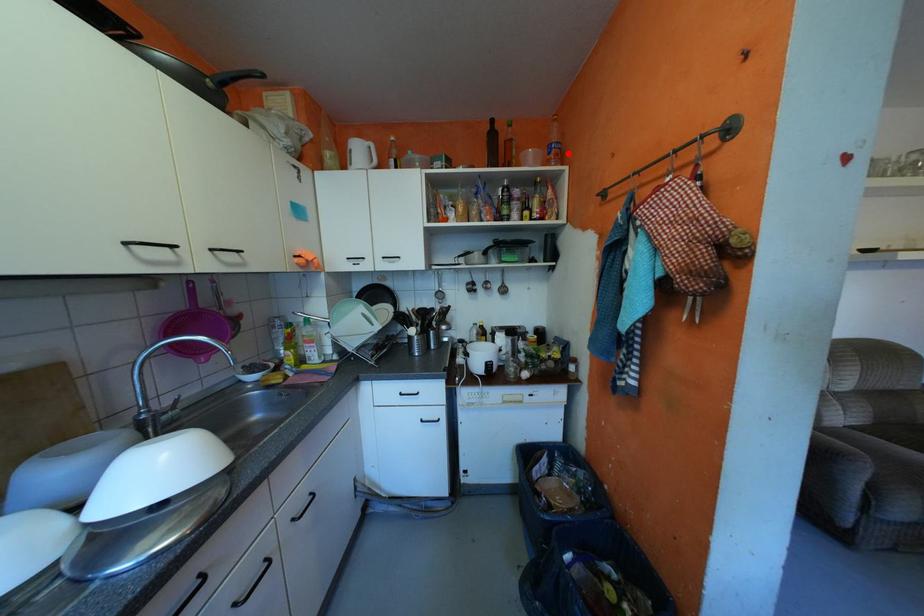
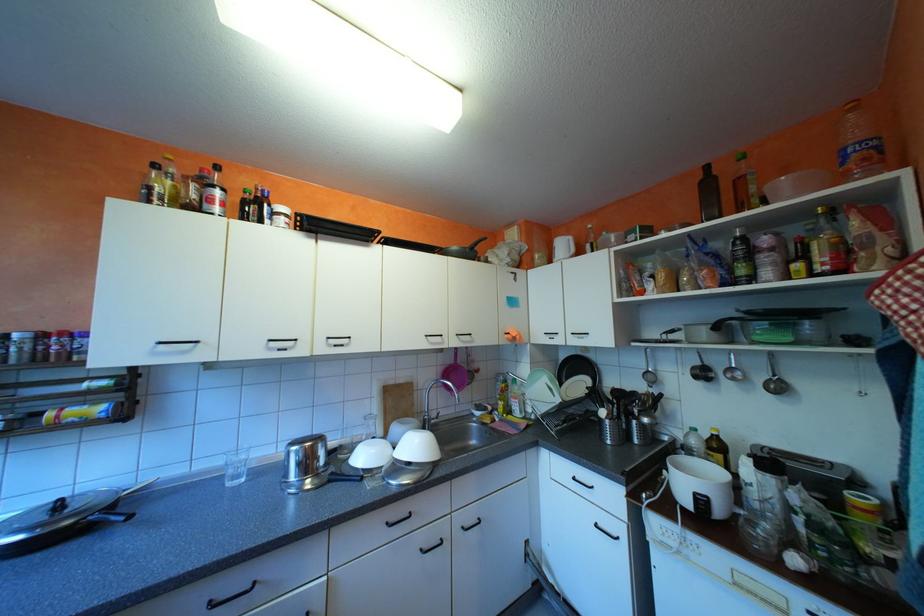
Question: A red point is marked in image1. In image2, is the corresponding 3D point closer to the camera or farther? Reply with the corresponding letter.

Choices:
 (A) The corresponding 3D point is closer.
 (B) The corresponding 3D point is farther.

Answer: (A)